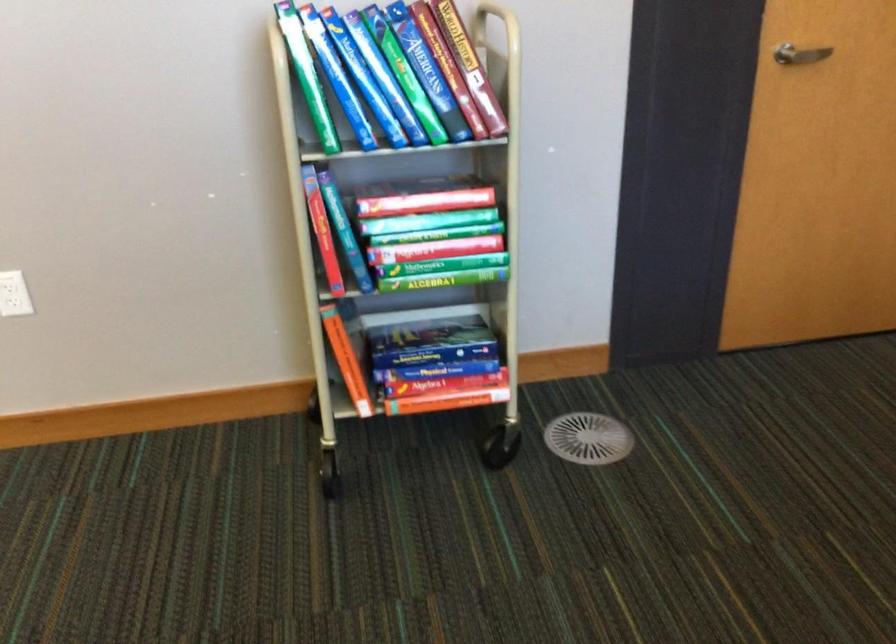
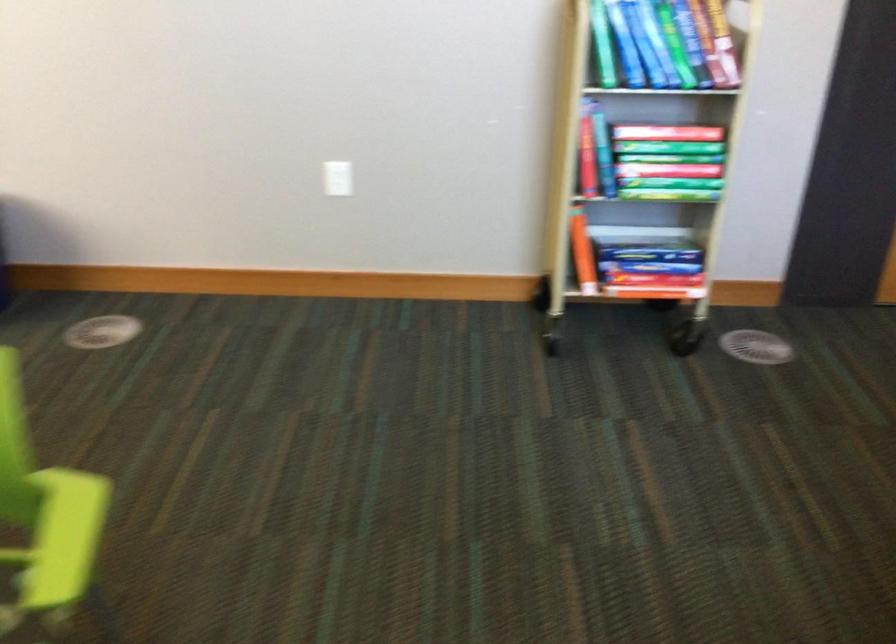
Question: The camera is either moving clockwise (left) or counter-clockwise (right) around the object. The first image is from the beginning of the video and the second image is from the end. Is the camera moving left or right when shooting the video?

Choices:
 (A) Left
 (B) Right

Answer: (B)